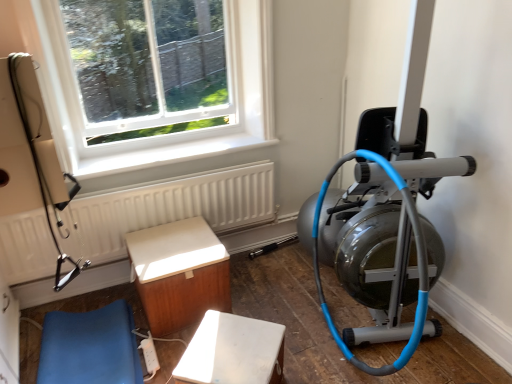
Find the location of a particular element. blank space above white matte bench at lower center, marked as the 3th furniture in a left-to-right arrangement (from a real-world perspective) is located at coordinates (228, 357).